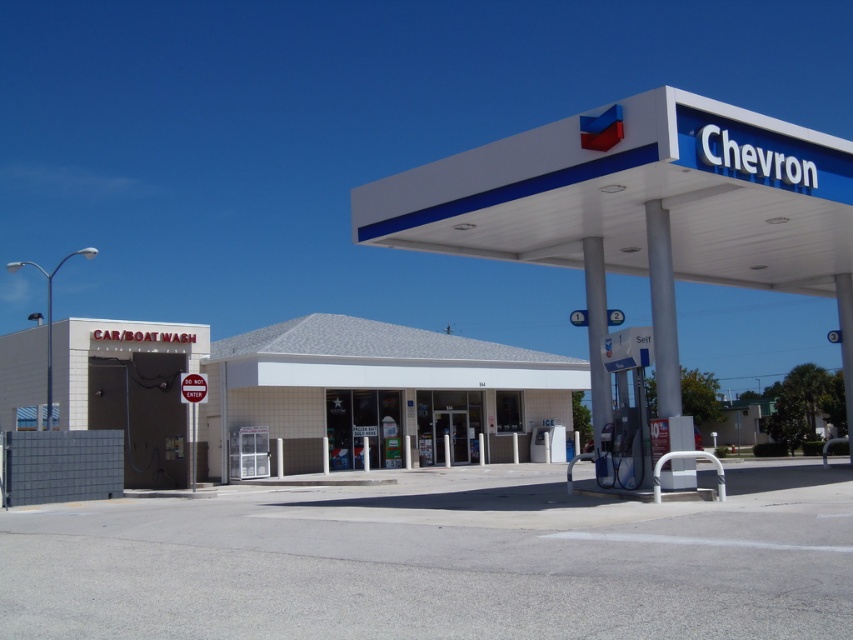
Question: Is white/smooth gas station canopy at center wider than white tile building at center?

Choices:
 (A) yes
 (B) no

Answer: (B)

Question: Is white/smooth gas station canopy at center positioned before white tile building at center?

Choices:
 (A) no
 (B) yes

Answer: (B)

Question: Which is farther from the white tile building at center?

Choices:
 (A) white tile car wash at lower left
 (B) white/smooth gas station canopy at center

Answer: (B)

Question: Does white/smooth gas station canopy at center appear over white tile building at center?

Choices:
 (A) yes
 (B) no

Answer: (A)

Question: Which point is closer to the camera?

Choices:
 (A) (239, 353)
 (B) (672, 115)

Answer: (B)

Question: Estimate the real-world distances between objects in this image. Which object is closer to the white/smooth gas station canopy at center?

Choices:
 (A) white tile building at center
 (B) white tile car wash at lower left

Answer: (A)